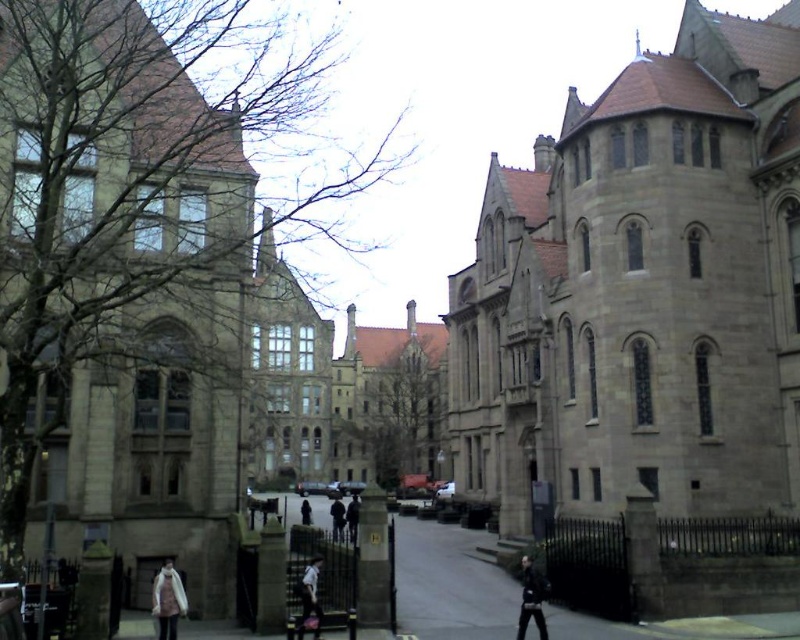
You are standing on the pathway in front of the historic stone buildings. You notice a bare branches at upper left and a black fabric person at center. Which object is taller?

The bare branches at upper left is taller than the black fabric person at center.

You are standing on the pathway in front of the historic stone buildings. There are two points marked on the path ahead of you. The first point is at coordinates point (216, 579) and the second is at point (341, 522). Which point is nearer to you as you stand on the pathway?

Point (216, 579) is closer to the viewer than point (341, 522), so the first point is nearer to you.

Consider the image. You are standing at the entrance of the historic stone building complex and notice a point marked at coordinates (137, 252). What object or feature does this point correspond to in the scene?

The point at coordinates (137, 252) corresponds to bare branches at upper left.